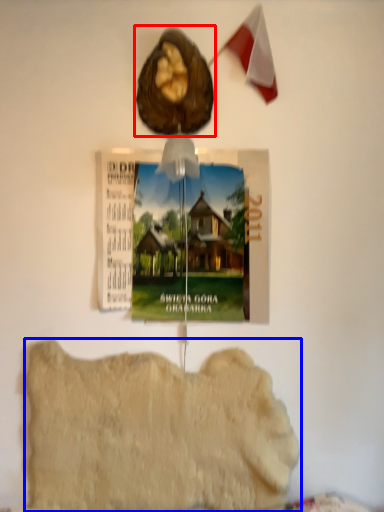
Question: Which point is closer to the camera, animal (highlighted by a red box) or food (highlighted by a blue box)?

Choices:
 (A) animal
 (B) food

Answer: (A)